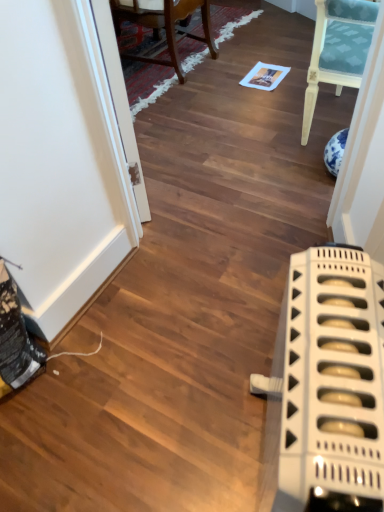
Locate an element on the screen. vacant space situated above white plastic radiator at lower right (from a real-world perspective) is located at coordinates (336, 361).